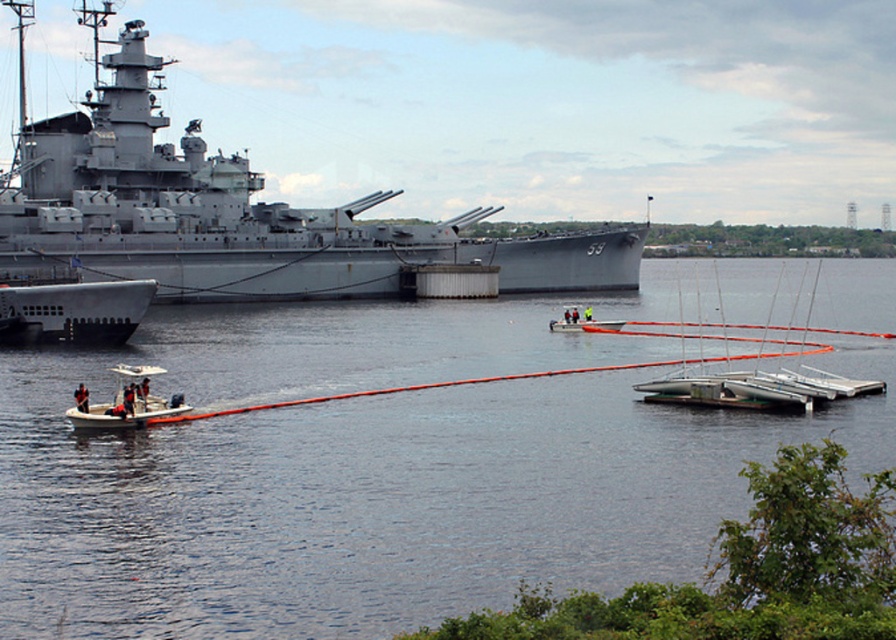
Question: Based on their relative distances, which object is farther from the white plastic boats at right?

Choices:
 (A) orange rubber tube at center
 (B) white plastic boat at left

Answer: (B)

Question: In this image, where is gray metallic battleship at upper left located relative to white plastic boats at right?

Choices:
 (A) left
 (B) right

Answer: (A)

Question: Is white plastic boats at right smaller than dark blue fabric life vest at lower left?

Choices:
 (A) no
 (B) yes

Answer: (A)

Question: Which point is closer to the camera taking this photo?

Choices:
 (A) (554, 326)
 (B) (83, 406)
 (C) (849, 332)
 (D) (122, 401)

Answer: (B)

Question: Does brushed metal boat at left lie behind dark blue fabric life jacket at lower left?

Choices:
 (A) no
 (B) yes

Answer: (B)

Question: Which point is closer to the camera taking this photo?

Choices:
 (A) (178, 164)
 (B) (26, 324)
 (C) (343, 532)
 (D) (840, 381)

Answer: (C)